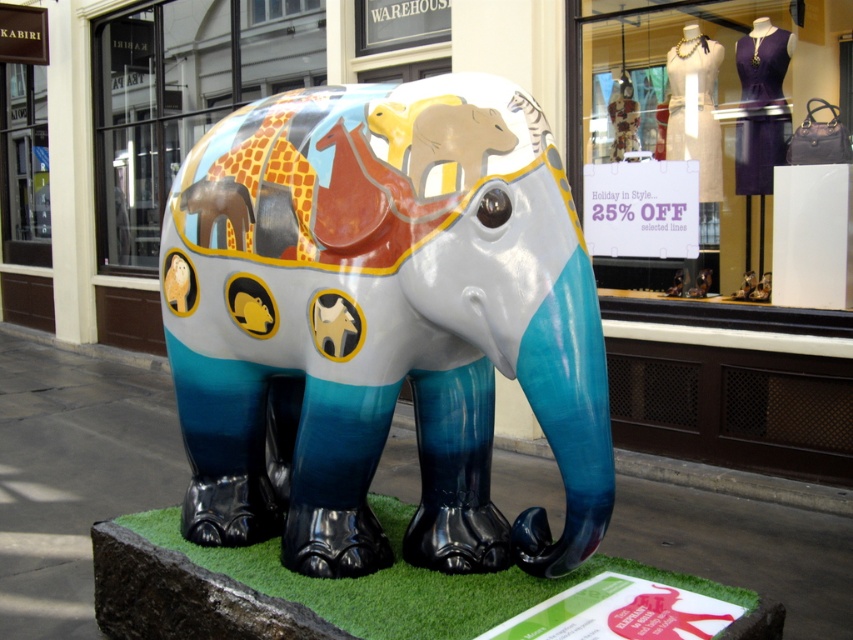
Does point (158, 109) come behind point (419, 584)?

That is True.

Does point (184, 64) come closer to viewer compared to point (608, 557)?

No, it is not.

This screenshot has width=853, height=640. In order to click on matte painted elephant at center in this screenshot , I will do `click(183, 97)`.

Is the position of shiny painted elephant at center less distant than that of matte painted elephant at center?

Yes, it is.

Between shiny painted elephant at center and matte painted elephant at center, which one appears on the right side from the viewer's perspective?

Positioned to the right is shiny painted elephant at center.

The image size is (853, 640). What are the coordinates of `shiny painted elephant at center` in the screenshot? It's located at (383, 321).

Is shiny painted elephant at center in front of green artificial turf at lower center?

Yes, it is in front of green artificial turf at lower center.

In order to click on shiny painted elephant at center in this screenshot , I will do `click(383, 321)`.

Identify the location of shiny painted elephant at center. (383, 321).